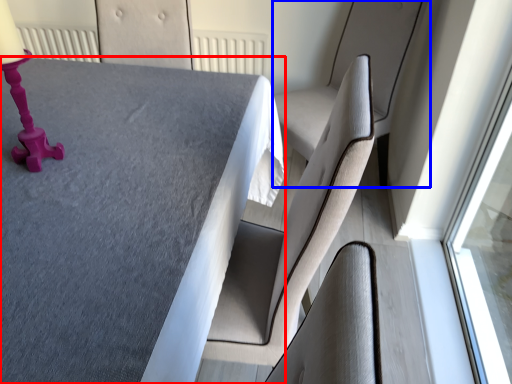
Question: Which object appears closest to the camera in this image, table (highlighted by a red box) or swivel chair (highlighted by a blue box)?

Choices:
 (A) table
 (B) swivel chair

Answer: (A)